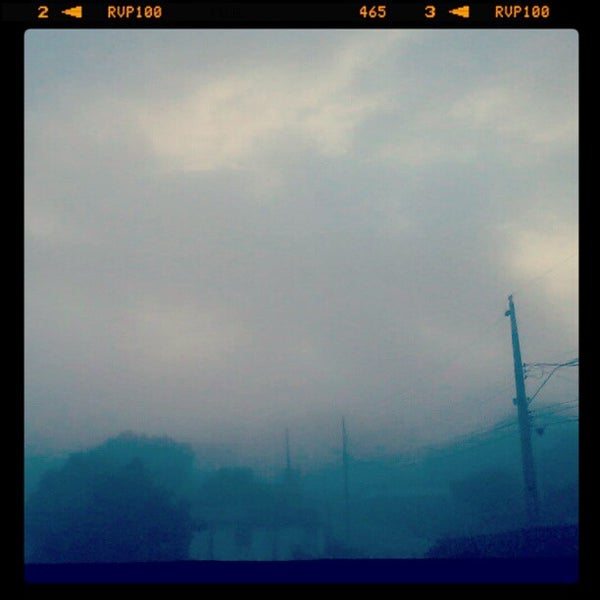
This screenshot has width=600, height=600. I want to click on cable, so click(x=560, y=404).